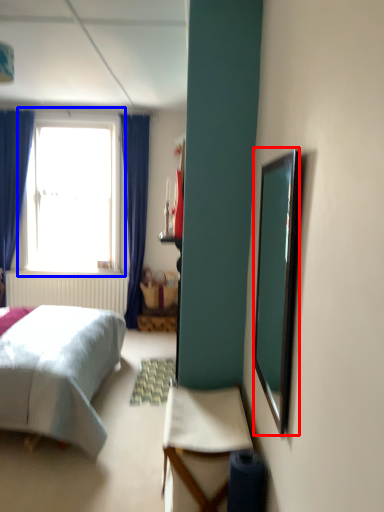
Question: Which object is further to the camera taking this photo, mirror (highlighted by a red box) or window (highlighted by a blue box)?

Choices:
 (A) mirror
 (B) window

Answer: (B)